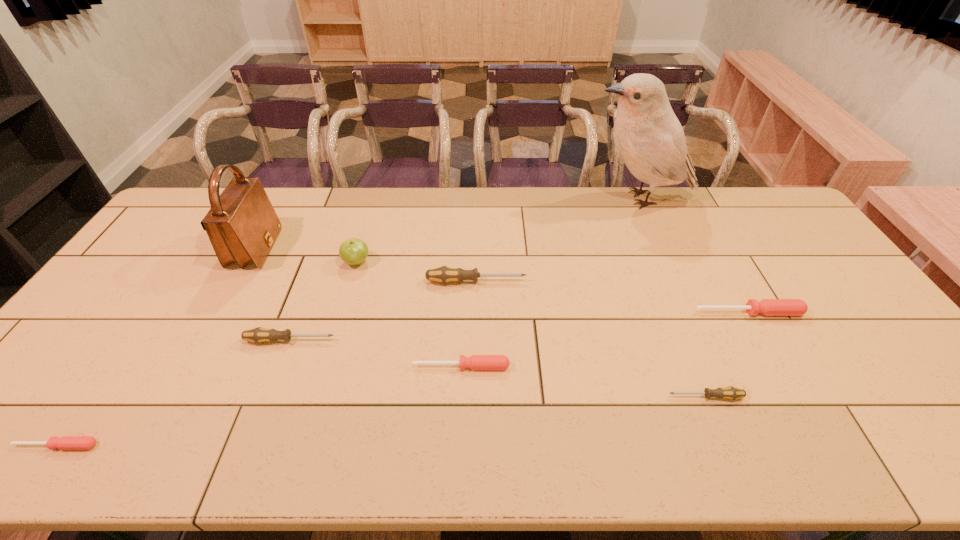
This screenshot has height=540, width=960. In order to click on vacant space located on the back of the nearest screwdriver in this screenshot , I will do `click(122, 350)`.

You are a GUI agent. You are given a task and a screenshot of the screen. Output one action in this format:
    pyautogui.click(x=<x>, y=<y>)
    Task: Click on the parakeet that is at the far edge
    The image size is (960, 540).
    Given the screenshot: What is the action you would take?
    point(647,134)

The height and width of the screenshot is (540, 960). Find the location of `shoulder bag positioned at the far edge`. shoulder bag positioned at the far edge is located at coordinates (242, 225).

This screenshot has height=540, width=960. I want to click on object located at the near edge, so click(x=66, y=442).

Identify the location of object situated at the left edge. This screenshot has width=960, height=540. (66, 442).

Locate an element on the screen. Image resolution: width=960 pixels, height=540 pixels. object at the near left corner is located at coordinates pos(66,442).

Image resolution: width=960 pixels, height=540 pixels. I want to click on free location at the far edge, so click(x=414, y=208).

Find the location of `free space at the near edge`. free space at the near edge is located at coordinates (176, 461).

Where is `vacant area at the left edge`? Image resolution: width=960 pixels, height=540 pixels. vacant area at the left edge is located at coordinates (100, 360).

Where is `vacant area at the right edge of the desktop`? This screenshot has width=960, height=540. vacant area at the right edge of the desktop is located at coordinates (853, 360).